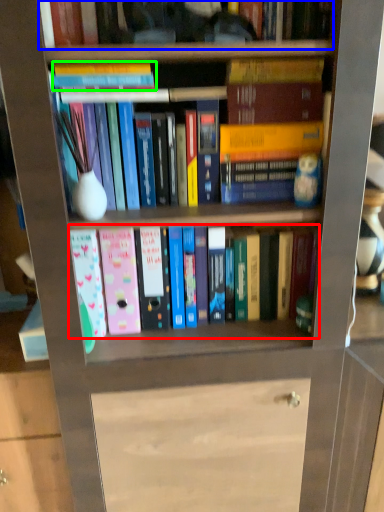
Question: Considering the real-world distances, which object is farthest from book (highlighted by a red box)? book (highlighted by a blue box) or book (highlighted by a green box)?

Choices:
 (A) book
 (B) book

Answer: (A)